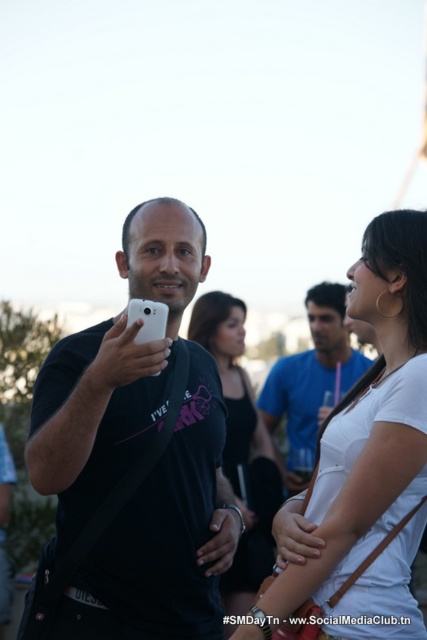
You are standing at the point labeled as point [166,216] and want to walk to the point labeled as point [204,310]. Which direction should you move in to reach your destination?

To reach point [204,310] from point [166,216], you should move towards the direction where point [204,310] is located, which is behind point [166,216] based on their spatial relationship.

Based on the scene description, where is the white matte phone at center located in terms of coordinates?

The white matte phone at center is located at coordinates point (136,456).